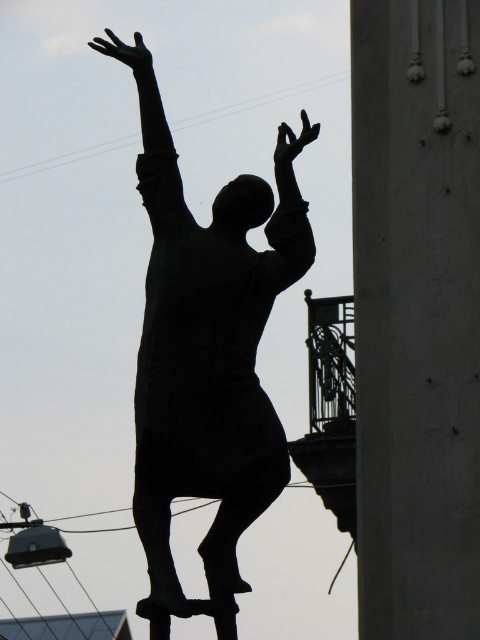
You are an art student analyzing the statue in the image. You notice the black matte statue at center and the black matte arm at center. Which object is taller?

The black matte statue at center is taller than the black matte arm at center.

You are a photographer planning to take a picture of the black matte statue at center. The statue is located at coordinates point 0.537, 0.433. If you want to frame the statue precisely within a rectangular area of 0.5x0.5 units, will the statue fit entirely within this frame?

The statue is positioned at point (207, 342). The rectangular frame of 0.5x0.5 units would extend from 0.2685 to 0.8055 in the x and y directions. Since the statue is centered at (207, 342), which lies within these bounds, the statue will fit entirely within the frame.

You are standing at the origin point in the image. The black matte statue at center is at coordinates 0.537 on the x and 0.433 on the y. If you want to move directly towards the statue, in which direction should you head?

The black matte statue at center is located at coordinates 0.537 on the x and 0.433 on the y. To move directly towards it from the origin, you should head northeast since the x and y values are both positive and greater than zero.